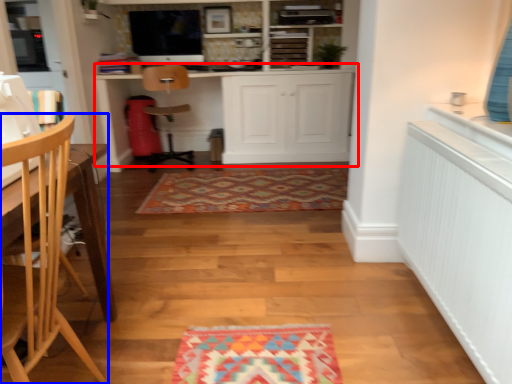
Question: Which point is closer to the camera, cabinetry (highlighted by a red box) or chair (highlighted by a blue box)?

Choices:
 (A) cabinetry
 (B) chair

Answer: (B)